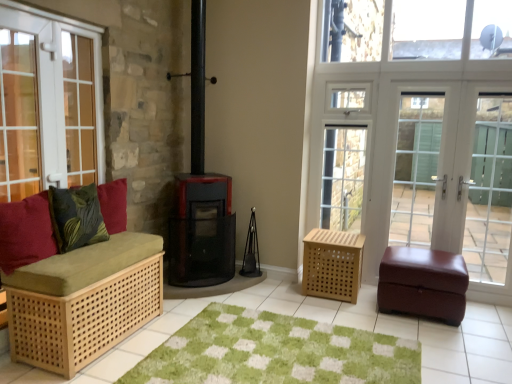
Question: Considering the relative sizes of light brown woven basket at center-right, which ranks as the 2th furniture in left-to-right order, and velvety green pillow at left, the first pillow when ordered from back to front, in the image provided, is light brown woven basket at center-right, which ranks as the 2th furniture in left-to-right order, shorter than velvety green pillow at left, the first pillow when ordered from back to front,?

Choices:
 (A) no
 (B) yes

Answer: (A)

Question: Is light brown woven basket at center-right, which ranks as the 2th furniture in left-to-right order, positioned with its back to velvety green pillow at left, the 2th pillow viewed from the front?

Choices:
 (A) no
 (B) yes

Answer: (A)

Question: From a real-world perspective, is light brown woven basket at center-right, the second furniture when ordered from right to left, located higher than velvety green pillow at left, the first pillow when ordered from back to front?

Choices:
 (A) yes
 (B) no

Answer: (B)

Question: From the image's perspective, is light brown woven basket at center-right, which ranks as the 2th furniture in left-to-right order, located above velvety green pillow at left, the first pillow when ordered from back to front?

Choices:
 (A) no
 (B) yes

Answer: (A)

Question: Considering the relative sizes of light brown woven basket at center-right, which ranks as the 2th furniture in left-to-right order, and velvety green pillow at left, the first pillow when ordered from back to front, in the image provided, is light brown woven basket at center-right, which ranks as the 2th furniture in left-to-right order, bigger than velvety green pillow at left, the first pillow when ordered from back to front,?

Choices:
 (A) no
 (B) yes

Answer: (B)

Question: In the image, is burgundy leather ottoman at right, arranged as the 1th furniture when viewed from the right, on the left side or the right side of black mesh wood burning stove at center?

Choices:
 (A) right
 (B) left

Answer: (A)

Question: From the image's perspective, is burgundy leather ottoman at right, which is the 3th furniture in left-to-right order, above or below black mesh wood burning stove at center?

Choices:
 (A) below
 (B) above

Answer: (A)

Question: Does point (431, 283) appear closer or farther from the camera than point (178, 268)?

Choices:
 (A) farther
 (B) closer

Answer: (B)

Question: Is burgundy leather ottoman at right, arranged as the 1th furniture when viewed from the right, spatially inside black mesh wood burning stove at center, or outside of it?

Choices:
 (A) inside
 (B) outside

Answer: (B)

Question: Is white glass screen door at right, the 3th screen door viewed from the left, situated inside matte white screen door at right, the 2th screen door in the right-to-left sequence, or outside?

Choices:
 (A) outside
 (B) inside

Answer: (B)

Question: Looking at the image, does white glass screen door at right, which ranks as the 1th screen door in right-to-left order, seem bigger or smaller compared to matte white screen door at right, the 2th screen door in the right-to-left sequence?

Choices:
 (A) small
 (B) big

Answer: (A)

Question: Considering the positions of point (497, 157) and point (412, 180), is point (497, 157) closer or farther from the camera than point (412, 180)?

Choices:
 (A) farther
 (B) closer

Answer: (B)

Question: Relative to matte white screen door at right, the second screen door in the left-to-right sequence, is white glass screen door at right, the 3th screen door viewed from the left, in front or behind?

Choices:
 (A) behind
 (B) front

Answer: (B)

Question: Based on their positions, is white glass screen door at right, which ranks as the 1th screen door in right-to-left order, located to the left or right of white glass door at left?

Choices:
 (A) left
 (B) right

Answer: (B)

Question: Considering the positions of white glass screen door at right, the 3th screen door viewed from the left, and white glass door at left in the image, is white glass screen door at right, the 3th screen door viewed from the left, wider or thinner than white glass door at left?

Choices:
 (A) thin
 (B) wide

Answer: (A)